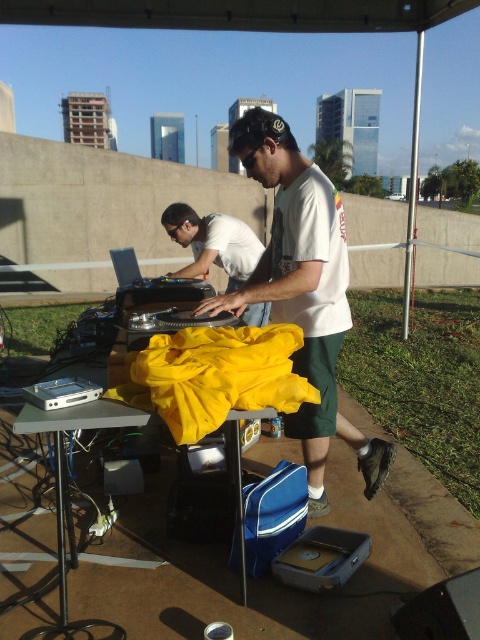
Question: Which point is farther to the camera?

Choices:
 (A) (202, 243)
 (B) (240, 301)

Answer: (A)

Question: Can you confirm if white cotton t-shirt at center is wider than white matte shirt at center?

Choices:
 (A) yes
 (B) no

Answer: (A)

Question: Which point is farther to the camera?

Choices:
 (A) white cotton t-shirt at center
 (B) white matte shirt at center

Answer: (B)

Question: Does white cotton t-shirt at center have a greater width compared to white matte shirt at center?

Choices:
 (A) yes
 (B) no

Answer: (A)

Question: Among these objects, which one is nearest to the camera?

Choices:
 (A) white matte shirt at center
 (B) white cotton t-shirt at center

Answer: (B)

Question: Is white cotton t-shirt at center smaller than white matte shirt at center?

Choices:
 (A) yes
 (B) no

Answer: (B)